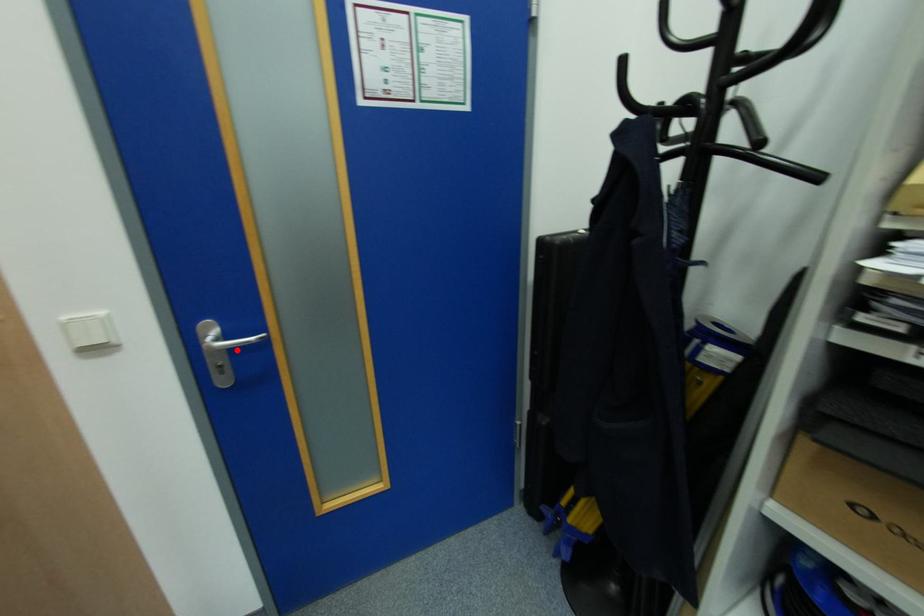
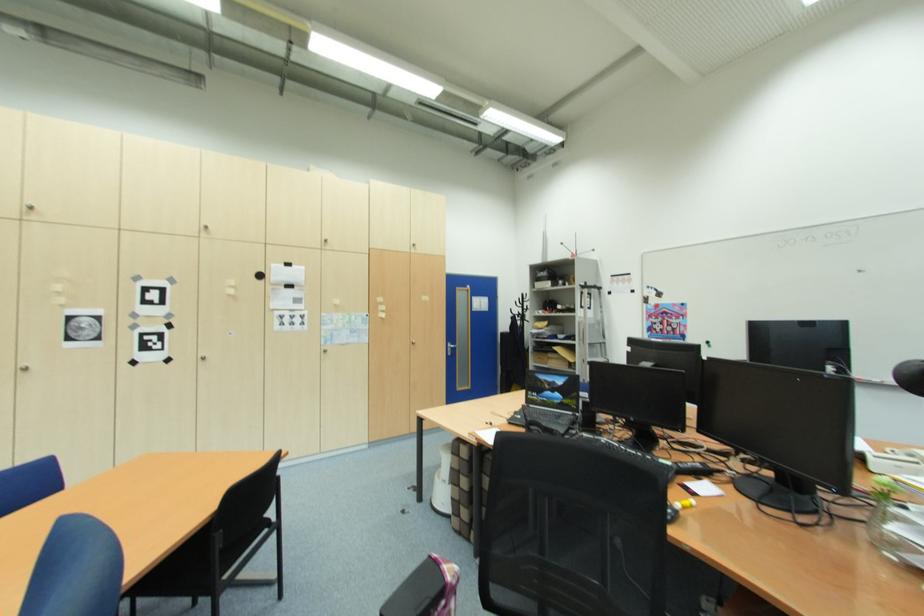
Where in the second image is the point corresponding to the highlighted location from the first image?

(456, 350)